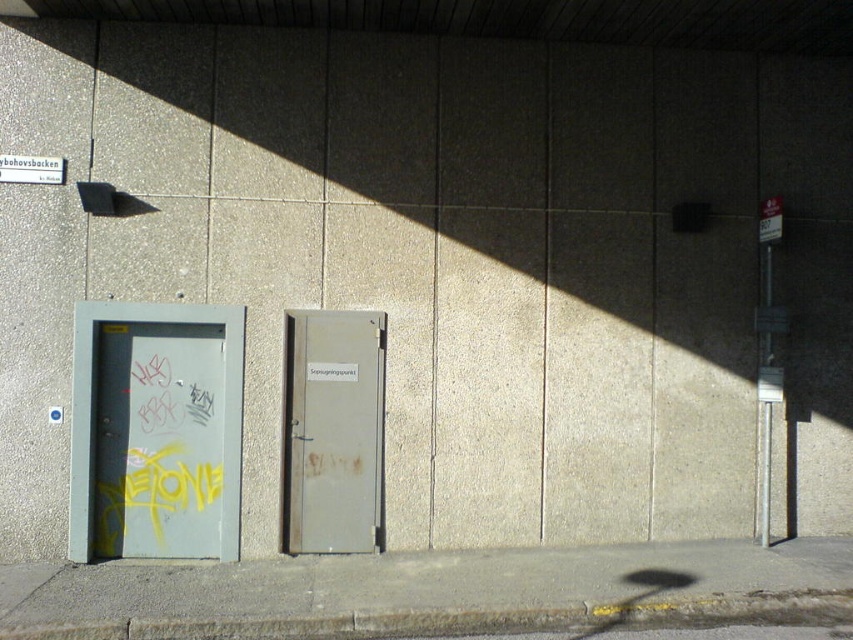
Question: From the image, what is the correct spatial relationship of metallic gray door at left in relation to rusty metal door at center?

Choices:
 (A) below
 (B) above

Answer: (B)

Question: Is metallic gray door at left to the right of rusty metal door at center from the viewer's perspective?

Choices:
 (A) no
 (B) yes

Answer: (A)

Question: Which point is farther to the camera?

Choices:
 (A) metallic gray door at left
 (B) rusty metal door at center

Answer: (B)

Question: Is metallic gray door at left above rusty metal door at center?

Choices:
 (A) no
 (B) yes

Answer: (B)

Question: Which point is closer to the camera?

Choices:
 (A) rusty metal door at center
 (B) metallic gray door at left

Answer: (B)